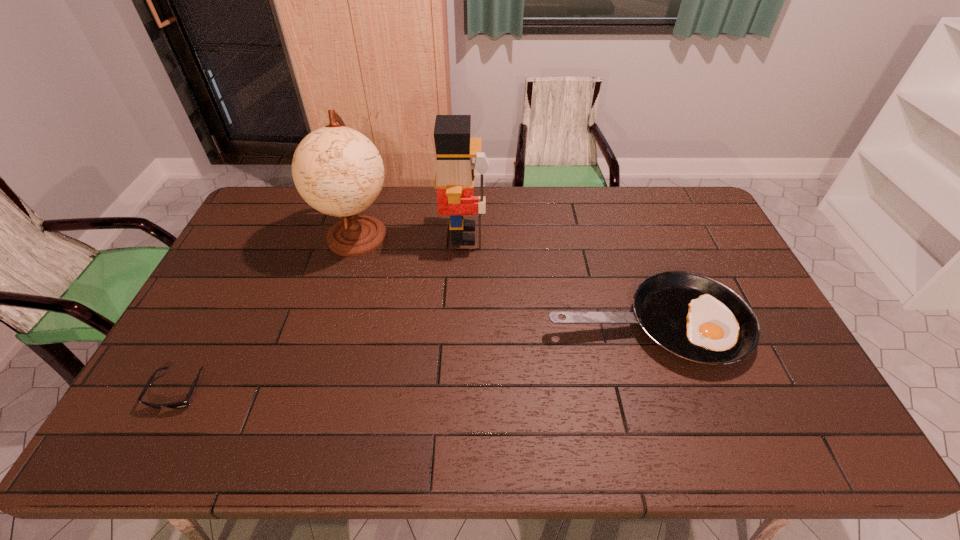
Locate an element on the screen. The image size is (960, 540). vacant space in between the leftmost object and the second object from left to right is located at coordinates (268, 313).

Locate an element on the screen. free point between the third tallest object and the globe is located at coordinates (502, 280).

Image resolution: width=960 pixels, height=540 pixels. I want to click on free space between the third object from right to left and the nutcracker, so click(411, 235).

I want to click on blank region between the nutcracker and the third object from right to left, so click(x=411, y=235).

At what (x,y) coordinates should I click in order to perform the action: click on free space between the frying pan and the third object from left to right. Please return your answer as a coordinate pair (x, y). Looking at the image, I should click on (555, 280).

Locate an element on the screen. Image resolution: width=960 pixels, height=540 pixels. vacant region between the second object from left to right and the frying pan is located at coordinates (502, 280).

In order to click on free space that is in between the sunglasses and the nutcracker in this screenshot , I will do `click(322, 313)`.

Where is `vacant space that is in between the globe and the nutcracker`? vacant space that is in between the globe and the nutcracker is located at coordinates (411, 235).

Image resolution: width=960 pixels, height=540 pixels. Identify the location of object that is the third closest to the globe. (695, 318).

Identify which object is the nearest to the third object from left to right. Please provide its 2D coordinates. Your answer should be formatted as a tuple, i.e. [(x, y)], where the tuple contains the x and y coordinates of a point satisfying the conditions above.

[(338, 171)]